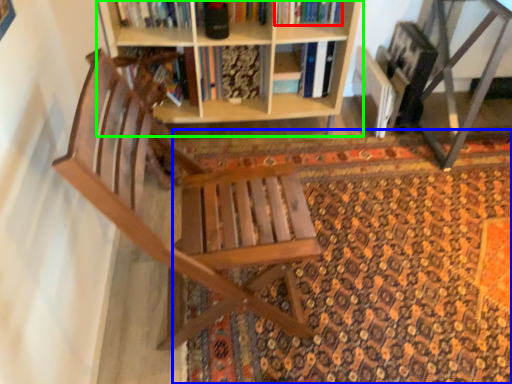
Question: Based on their relative distances, which object is nearer to book (highlighted by a red box)? Choose from doormat (highlighted by a blue box) and shelf (highlighted by a green box).

Choices:
 (A) doormat
 (B) shelf

Answer: (B)